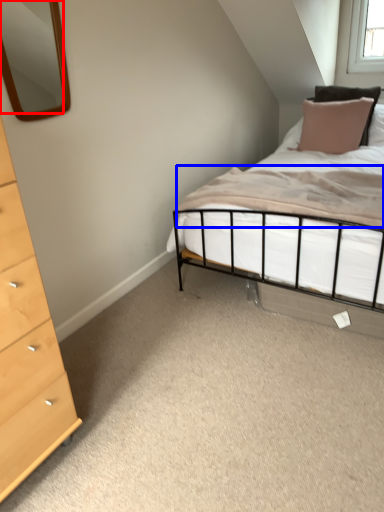
Question: Which object appears farthest to the camera in this image, mirror (highlighted by a red box) or mattress (highlighted by a blue box)?

Choices:
 (A) mirror
 (B) mattress

Answer: (B)